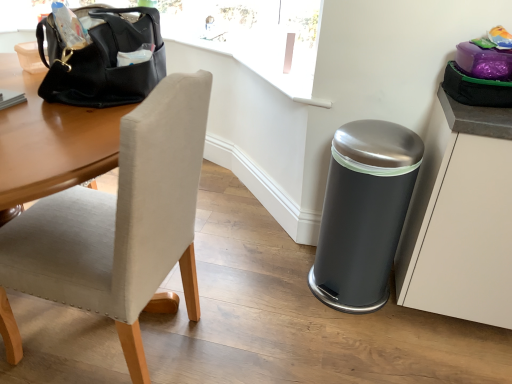
This screenshot has height=384, width=512. I want to click on vacant area that lies between beige fabric chair at left and satin silver trash can at lower right, so click(262, 304).